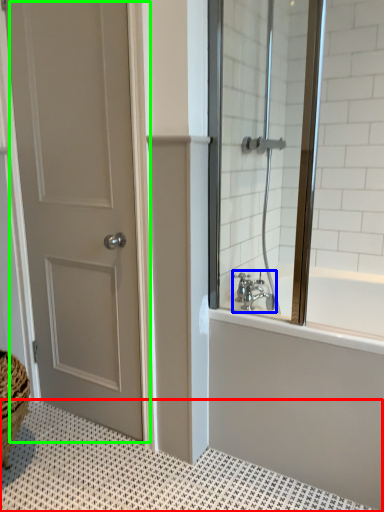
Question: Based on their relative distances, which object is nearer to bath mat (highlighted by a red box)? Choose from tap (highlighted by a blue box) and door (highlighted by a green box).

Choices:
 (A) tap
 (B) door

Answer: (B)